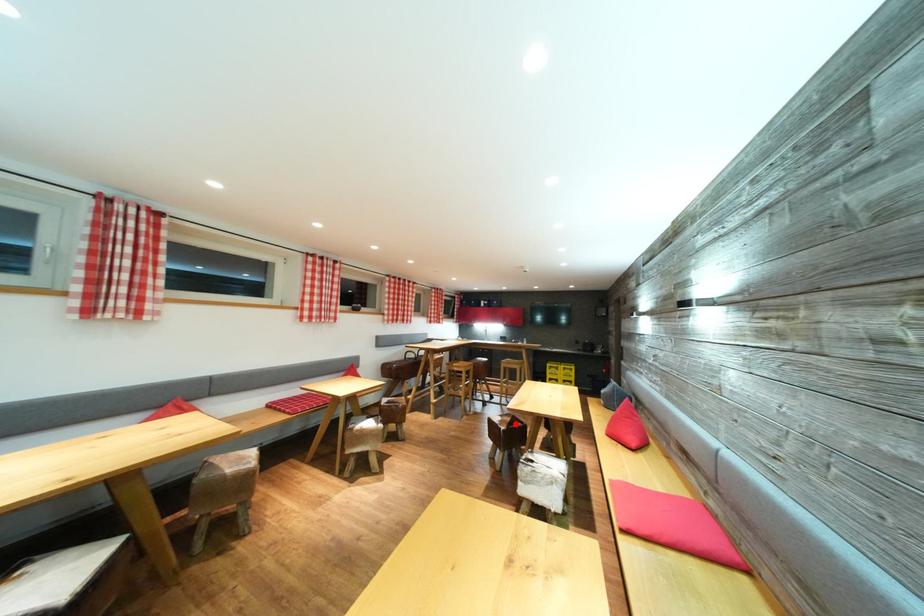
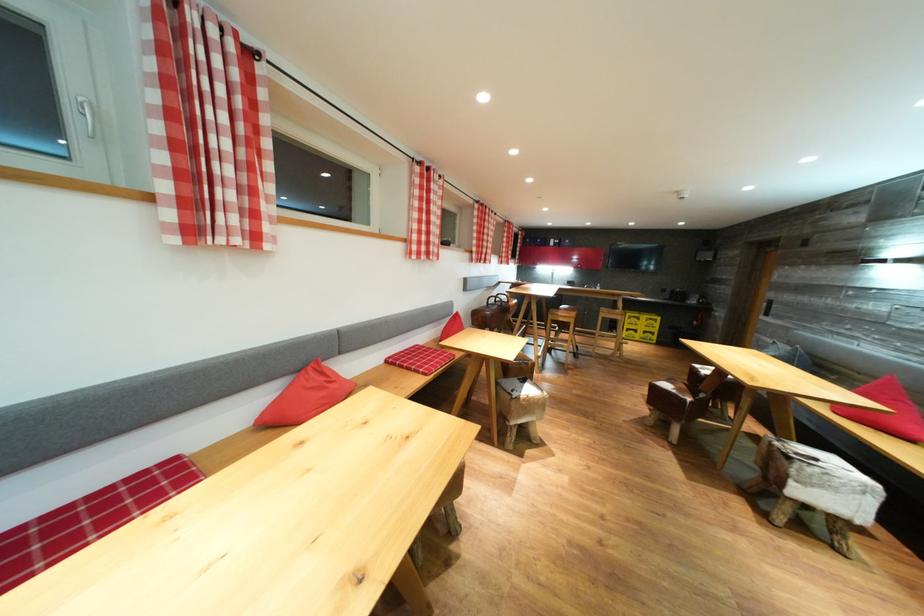
Question: I am providing you with two images of the same scene from different viewpoints. Image1 has a red point marked. In image2, the corresponding 3D location appears at what relative position? Reply with the corresponding letter.

Choices:
 (A) Closer
 (B) Farther

Answer: (B)